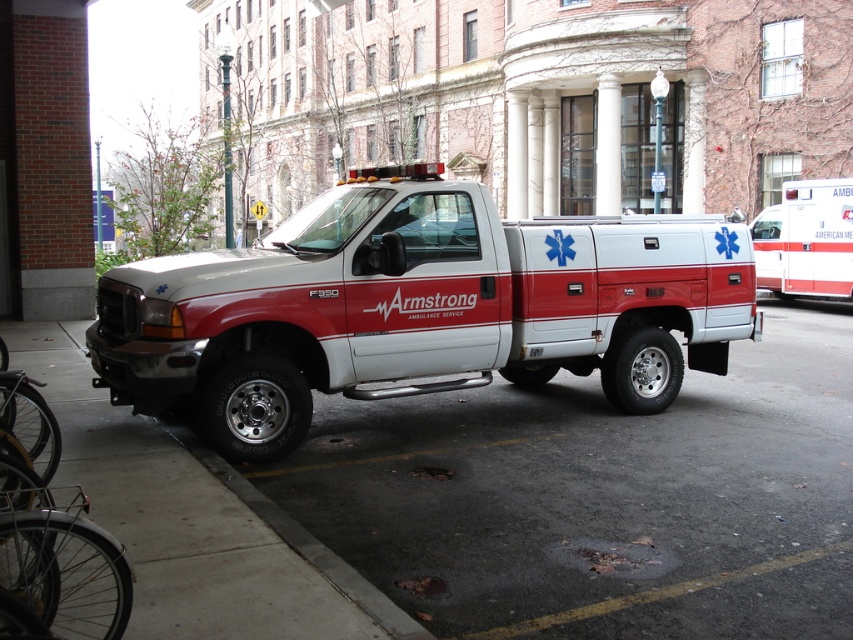
Question: Is smooth asphalt at center smaller than white matte ambulance at center?

Choices:
 (A) yes
 (B) no

Answer: (B)

Question: Which point appears closest to the camera in this image?

Choices:
 (A) (648, 496)
 (B) (833, 193)

Answer: (A)

Question: Considering the relative positions of smooth asphalt at center and white glossy ambulance at right in the image provided, where is smooth asphalt at center located with respect to white glossy ambulance at right?

Choices:
 (A) right
 (B) left

Answer: (B)

Question: Which object appears farthest from the camera in this image?

Choices:
 (A) white glossy ambulance at right
 (B) smooth asphalt at center

Answer: (A)

Question: Does white matte ambulance at center have a smaller size compared to white glossy ambulance at right?

Choices:
 (A) no
 (B) yes

Answer: (B)

Question: Which of the following is the closest to the observer?

Choices:
 (A) (828, 205)
 (B) (457, 253)

Answer: (B)